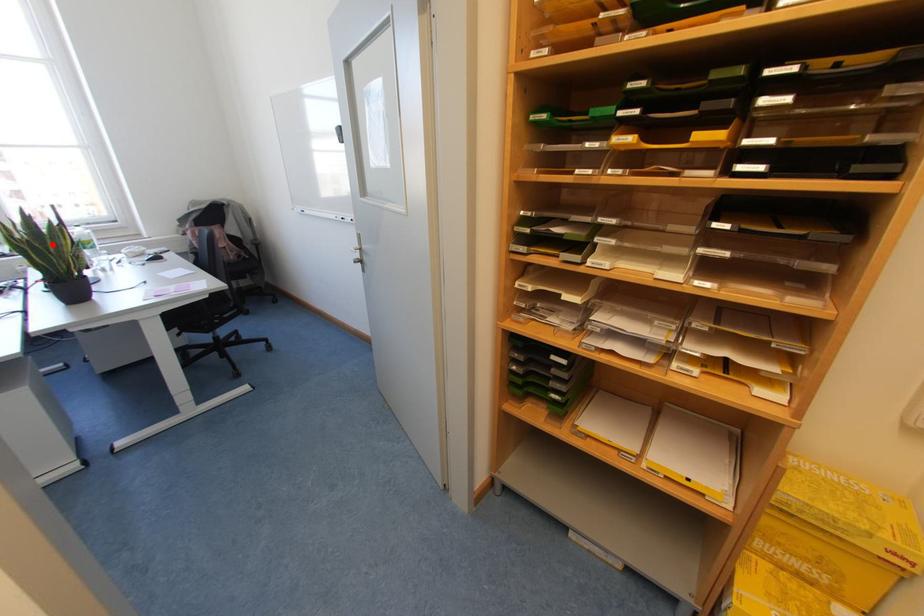
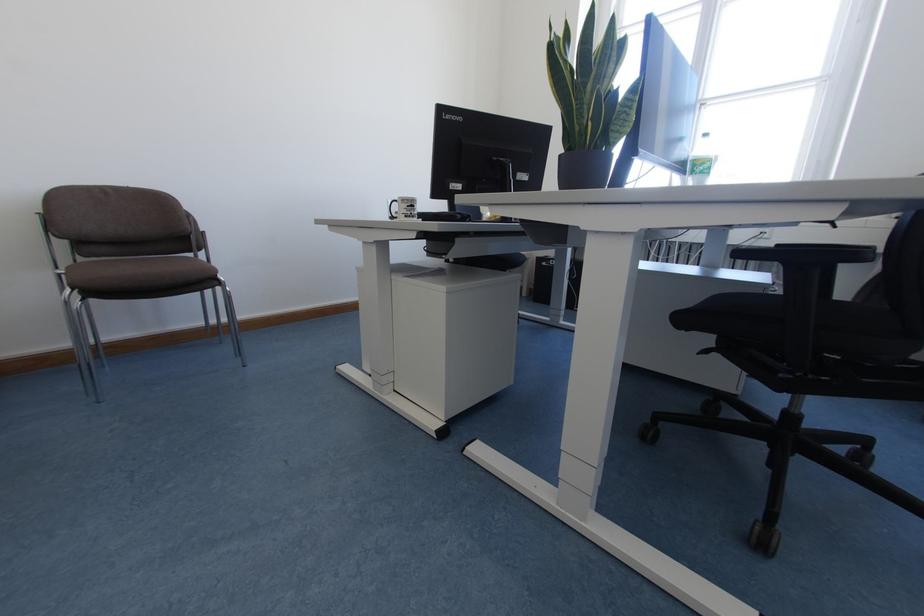
In the second image, find the point that corresponds to the highlighted location in the first image.

(593, 77)